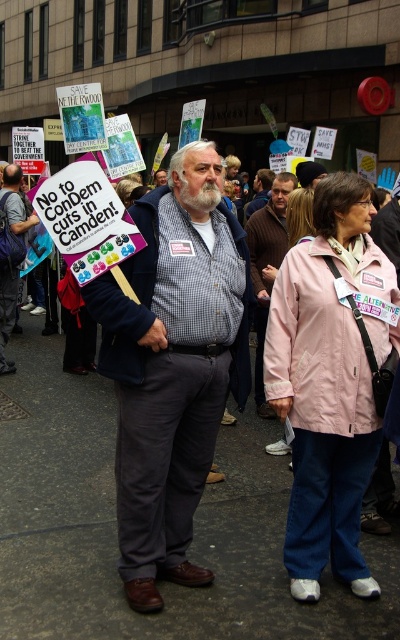
You are a photographer standing at the camera position. You want to take a closeup shot of the pink fabric jacket at center. Considering the distance between you and the jacket, is it feasible to capture a clear closeup without moving closer?

The distance between the pink fabric jacket at center and the camera is 2.74 meters. A standard camera lens can typically achieve a clear closeup at this distance, so it is feasible to capture a clear image without moving closer.

You are a photographer standing at the center of the protest scene. You want to take a photo that includes both the checkered fabric shirt at center and the pink fabric jacket at center. Given that your camera has a 100mm lens with a field of view that can capture objects up to 20 inches apart, will you be able to fit both subjects in the frame without moving closer?

The checkered fabric shirt at center is 22.60 inches away from the pink fabric jacket at center. Since the camera lens can only capture up to 20 inches, the distance between them exceeds the field of view. Therefore, you cannot fit both subjects in the frame without moving closer.

From the picture: You are a photographer trying to capture a clear shot of both the pink fabric jacket at center and the brown wool sweater at center. Since the photographer can only focus on one subject at a time, which one should you choose to ensure the other is still somewhat in focus?

The pink fabric jacket at center is closer to the viewer than the brown wool sweater at center, so focusing on the pink fabric jacket at center would keep the brown wool sweater at center in better focus compared to focusing on the sweater.